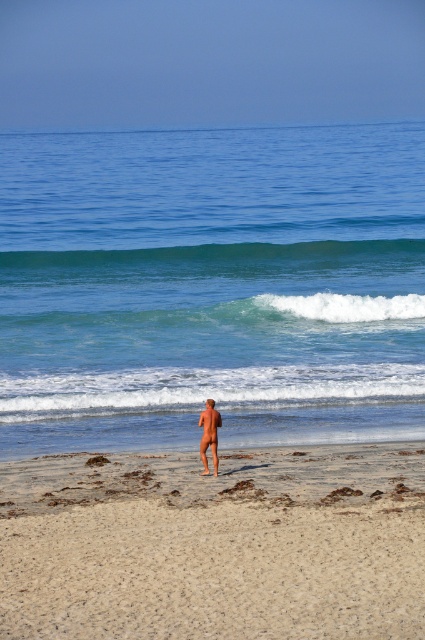
From the picture: Measure the distance from smooth sand at center to smooth tan skin at center.

smooth sand at center and smooth tan skin at center are 2.41 meters apart.

Does smooth sand at center have a larger size compared to smooth tan skin at center?

Indeed, smooth sand at center has a larger size compared to smooth tan skin at center.

The width and height of the screenshot is (425, 640). What are the coordinates of `smooth sand at center` in the screenshot? It's located at (215, 545).

Find the location of a particular element. This screenshot has width=425, height=640. smooth sand at center is located at coordinates (215, 545).

Who is higher up, blue water at center or smooth tan skin at center?

Positioned higher is blue water at center.

How much distance is there between blue water at center and smooth tan skin at center?

blue water at center and smooth tan skin at center are 30.41 meters apart from each other.

This screenshot has height=640, width=425. In order to click on blue water at center in this screenshot , I will do `click(210, 285)`.

Can you confirm if blue water at center is positioned to the left of smooth sand at center?

Correct, you'll find blue water at center to the left of smooth sand at center.

Between point (280, 250) and point (192, 472), which one is positioned in front?

Point (192, 472)

Find the location of a particular element. Image resolution: width=425 pixels, height=640 pixels. blue water at center is located at coordinates [210, 285].